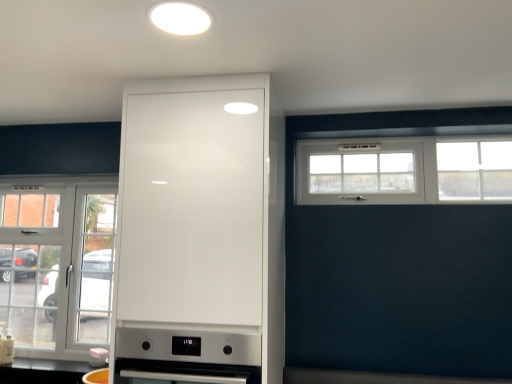
Question: Considering the relative sizes of matte white kettle at lower center, placed as the second appliance when sorted from right to left, and white plastic window at upper right, which is the 2th window from left to right, in the image provided, is matte white kettle at lower center, placed as the second appliance when sorted from right to left, thinner than white plastic window at upper right, which is the 2th window from left to right,?

Choices:
 (A) yes
 (B) no

Answer: (A)

Question: From a real-world perspective, is matte white kettle at lower center, the first appliance when ordered from bottom to top, beneath white plastic window at upper right, which is counted as the second window, starting from the back?

Choices:
 (A) no
 (B) yes

Answer: (B)

Question: Is matte white kettle at lower center, which is the 2th appliance in front-to-back order, bigger than white plastic window at upper right, which is counted as the 1th window, starting from the front?

Choices:
 (A) no
 (B) yes

Answer: (A)

Question: Does matte white kettle at lower center, the first appliance when ordered from bottom to top, have a greater width compared to white plastic window at upper right, positioned as the first window in right-to-left order?

Choices:
 (A) no
 (B) yes

Answer: (A)

Question: Is matte white kettle at lower center, the 1th appliance positioned from the back, behind white plastic window at upper right, which is counted as the 1th window, starting from the front?

Choices:
 (A) no
 (B) yes

Answer: (B)

Question: Is matte white kettle at lower center, which is the 2th appliance from top to bottom, wider or thinner than white plastic window at upper right, which is the 2th window from left to right?

Choices:
 (A) thin
 (B) wide

Answer: (A)

Question: In the image, is matte white kettle at lower center, arranged as the first appliance when viewed from the left, on the left side or the right side of white plastic window at upper right, which appears as the 2th window when ordered from the bottom?

Choices:
 (A) right
 (B) left

Answer: (B)

Question: From the image's perspective, is matte white kettle at lower center, the 1th appliance positioned from the back, located above or below white plastic window at upper right, acting as the first window starting from the top?

Choices:
 (A) below
 (B) above

Answer: (A)

Question: Is matte white kettle at lower center, placed as the second appliance when sorted from right to left, in front of or behind white plastic window at upper right, which is counted as the 1th window, starting from the front, in the image?

Choices:
 (A) behind
 (B) front

Answer: (A)

Question: From a real-world perspective, is white plastic window at upper right, which is counted as the 1th window, starting from the front, physically located above or below satin silver oven at center, positioned as the 1th appliance in top-to-bottom order?

Choices:
 (A) below
 (B) above

Answer: (B)

Question: Is white plastic window at upper right, which is counted as the second window, starting from the back, in front of or behind satin silver oven at center, which is the 1th appliance in front-to-back order, in the image?

Choices:
 (A) behind
 (B) front

Answer: (A)

Question: Is point (333, 193) closer or farther from the camera than point (157, 362)?

Choices:
 (A) closer
 (B) farther

Answer: (B)

Question: Is white plastic window at upper right, which is the 2th window from left to right, bigger or smaller than satin silver oven at center, placed as the second appliance when sorted from left to right?

Choices:
 (A) big
 (B) small

Answer: (B)

Question: From the image's perspective, is white matte light fixture at upper center above or below white glossy cabinet at center?

Choices:
 (A) below
 (B) above

Answer: (B)

Question: In the image, is white matte light fixture at upper center on the left side or the right side of white glossy cabinet at center?

Choices:
 (A) right
 (B) left

Answer: (B)